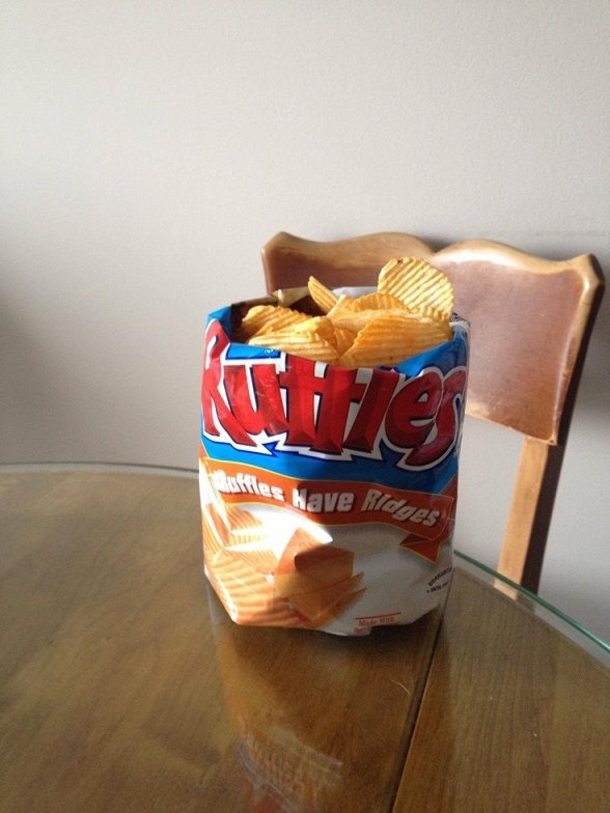
I want to click on wood table, so click(282, 761).